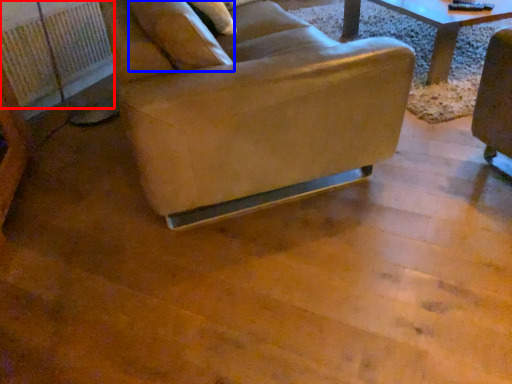
Question: Which point is further to the camera, radiator (highlighted by a red box) or pillow (highlighted by a blue box)?

Choices:
 (A) radiator
 (B) pillow

Answer: (A)